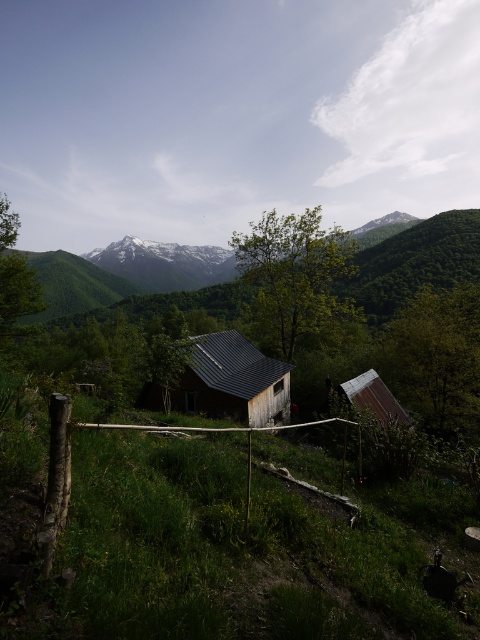
Question: Does dark gray shingles at center appear under rusty metal hut at lower right?

Choices:
 (A) no
 (B) yes

Answer: (B)

Question: Does dark gray shingles at center come behind rusty metal hut at lower right?

Choices:
 (A) no
 (B) yes

Answer: (B)

Question: Which point is farther from the camera taking this photo?

Choices:
 (A) (267, 422)
 (B) (376, 410)

Answer: (A)

Question: Can you confirm if dark gray shingles at center is positioned to the right of rusty metal hut at lower right?

Choices:
 (A) no
 (B) yes

Answer: (A)

Question: Which object appears closest to the camera in this image?

Choices:
 (A) dark gray shingles at center
 (B) rusty metal hut at lower right

Answer: (B)

Question: Which object appears closest to the camera in this image?

Choices:
 (A) dark gray shingles at center
 (B) rusty metal hut at lower right

Answer: (B)